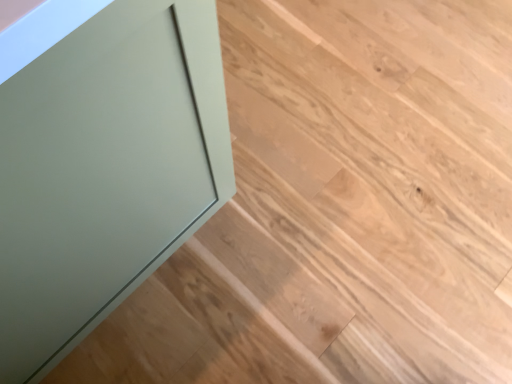
The image size is (512, 384). Find the location of `matte green cabinet at upper left`. matte green cabinet at upper left is located at coordinates (359, 197).

Describe the element at coordinates (359, 197) in the screenshot. I see `matte green cabinet at upper left` at that location.

The height and width of the screenshot is (384, 512). I want to click on matte green cabinet at upper left, so click(x=359, y=197).